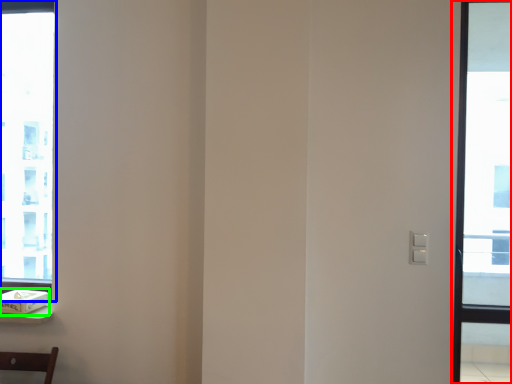
Question: Estimate the real-world distances between objects in this image. Which object is closer to window (highlighted by a red box), window (highlighted by a blue box) or box (highlighted by a green box)?

Choices:
 (A) window
 (B) box

Answer: (A)